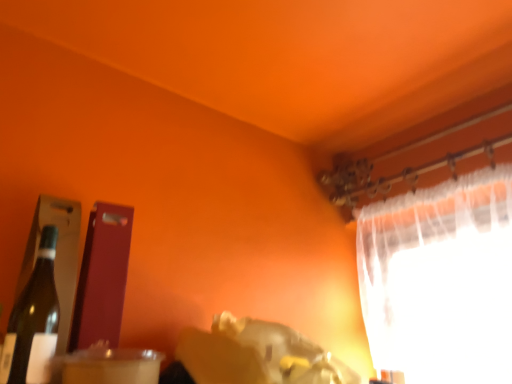
Measure the distance between point (431,193) and camera.

The distance of point (431,193) from camera is 4.88 feet.

Find the location of a particular element. white sheer curtain at upper right is located at coordinates (440, 280).

Find the location of `white sheer curtain at upper right`. white sheer curtain at upper right is located at coordinates (440, 280).

In the scene shown: From a real-world perspective, who is located lower, clear plastic straw at lower left or white sheer curtain at upper right?

In real-world perspective, clear plastic straw at lower left is lower.

Considering the positions of objects clear plastic straw at lower left and white sheer curtain at upper right in the image provided, who is in front, clear plastic straw at lower left or white sheer curtain at upper right?

clear plastic straw at lower left is closer to the camera.

Does clear plastic straw at lower left have a lesser width compared to white sheer curtain at upper right?

Yes, clear plastic straw at lower left is thinner than white sheer curtain at upper right.

Where is `drinking straw on the left side of white sheer curtain at upper right`? The width and height of the screenshot is (512, 384). drinking straw on the left side of white sheer curtain at upper right is located at coordinates (111, 371).

From the image's perspective, between matte glass bottle at left and clear plastic straw at lower left, which one is located above?

matte glass bottle at left appears higher in the image.

Is matte glass bottle at left next to clear plastic straw at lower left and touching it?

No.

Considering the relative sizes of matte glass bottle at left and clear plastic straw at lower left in the image provided, is matte glass bottle at left taller than clear plastic straw at lower left?

Yes.

From the image's perspective, is white sheer curtain at upper right above or below clear plastic straw at lower left?

Based on their image positions, white sheer curtain at upper right is located above clear plastic straw at lower left.

Is white sheer curtain at upper right facing towards clear plastic straw at lower left?

Yes, white sheer curtain at upper right is aimed at clear plastic straw at lower left.

Which object is wider, white sheer curtain at upper right or clear plastic straw at lower left?

Wider between the two is white sheer curtain at upper right.

Can you confirm if white sheer curtain at upper right is bigger than clear plastic straw at lower left?

Yes.

Could white sheer curtain at upper right be considered to be inside matte glass bottle at left?

Definitely not — white sheer curtain at upper right is not inside matte glass bottle at left.

From a real-world perspective, is matte glass bottle at left above or below white sheer curtain at upper right?

From a real-world perspective, matte glass bottle at left is physically below white sheer curtain at upper right.

From the image's perspective, which one is positioned lower, matte glass bottle at left or white sheer curtain at upper right?

white sheer curtain at upper right.

Is matte glass bottle at left next to white sheer curtain at upper right?

No, matte glass bottle at left is not in contact with white sheer curtain at upper right.

At what (x,y) coordinates should I click in order to perform the action: click on bottle on the left side of white sheer curtain at upper right. Please return your answer as a coordinate pair (x, y). This screenshot has width=512, height=384. Looking at the image, I should click on (34, 321).

In terms of width, does white sheer curtain at upper right look wider or thinner when compared to matte glass bottle at left?

In the image, white sheer curtain at upper right appears to be wider than matte glass bottle at left.

Looking at the image, does white sheer curtain at upper right seem bigger or smaller compared to matte glass bottle at left?

Clearly, white sheer curtain at upper right is larger in size than matte glass bottle at left.

Is white sheer curtain at upper right aimed at matte glass bottle at left?

Yes.

Is clear plastic straw at lower left in front of or behind matte glass bottle at left in the image?

clear plastic straw at lower left is positioned closer to the viewer than matte glass bottle at left.

Is clear plastic straw at lower left thinner than matte glass bottle at left?

Incorrect, the width of clear plastic straw at lower left is not less than that of matte glass bottle at left.

Does clear plastic straw at lower left touch matte glass bottle at left?

No, clear plastic straw at lower left is not next to matte glass bottle at left.

Could you tell me if clear plastic straw at lower left is facing matte glass bottle at left?

No, clear plastic straw at lower left is not oriented towards matte glass bottle at left.

Identify the location of curtain above the clear plastic straw at lower left (from a real-world perspective). (440, 280).

Where is `drinking straw to the right of matte glass bottle at left`? The height and width of the screenshot is (384, 512). drinking straw to the right of matte glass bottle at left is located at coordinates (111, 371).

From the image, which object appears to be farther from clear plastic straw at lower left, matte glass bottle at left or white sheer curtain at upper right?

white sheer curtain at upper right lies further to clear plastic straw at lower left than the other object.

When comparing their distances from matte glass bottle at left, does white sheer curtain at upper right or clear plastic straw at lower left seem further?

white sheer curtain at upper right is further to matte glass bottle at left.

Looking at the image, which one is located further to clear plastic straw at lower left, white sheer curtain at upper right or matte glass bottle at left?

The object further to clear plastic straw at lower left is white sheer curtain at upper right.

Looking at this image, based on their spatial positions, is clear plastic straw at lower left or matte glass bottle at left closer to white sheer curtain at upper right?

clear plastic straw at lower left is closer to white sheer curtain at upper right.

Considering their positions, is matte glass bottle at left positioned closer to white sheer curtain at upper right than clear plastic straw at lower left?

clear plastic straw at lower left is positioned closer to the anchor white sheer curtain at upper right.

Which object lies nearer to the anchor point matte glass bottle at left, clear plastic straw at lower left or white sheer curtain at upper right?

clear plastic straw at lower left.

The image size is (512, 384). I want to click on drinking straw between matte glass bottle at left and white sheer curtain at upper right from left to right, so [111, 371].